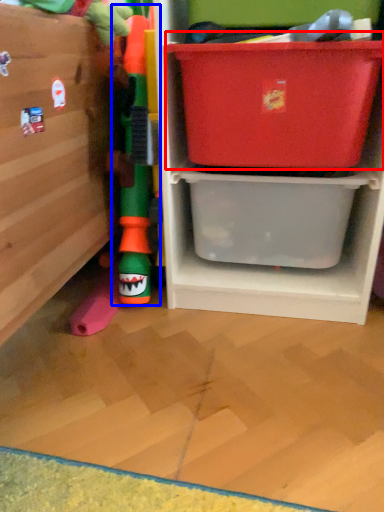
Question: Which object is closer to the camera taking this photo, storage box (highlighted by a red box) or toy (highlighted by a blue box)?

Choices:
 (A) storage box
 (B) toy

Answer: (A)